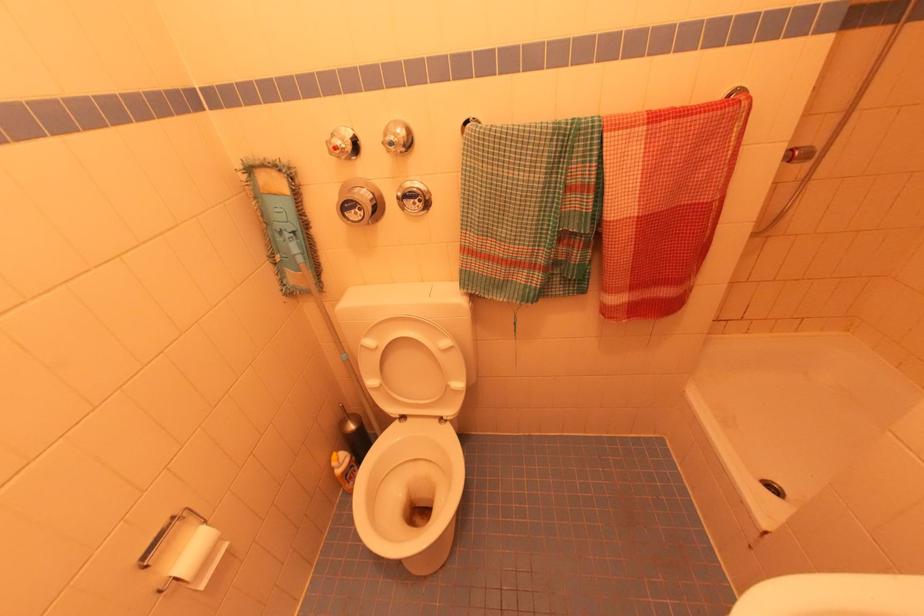
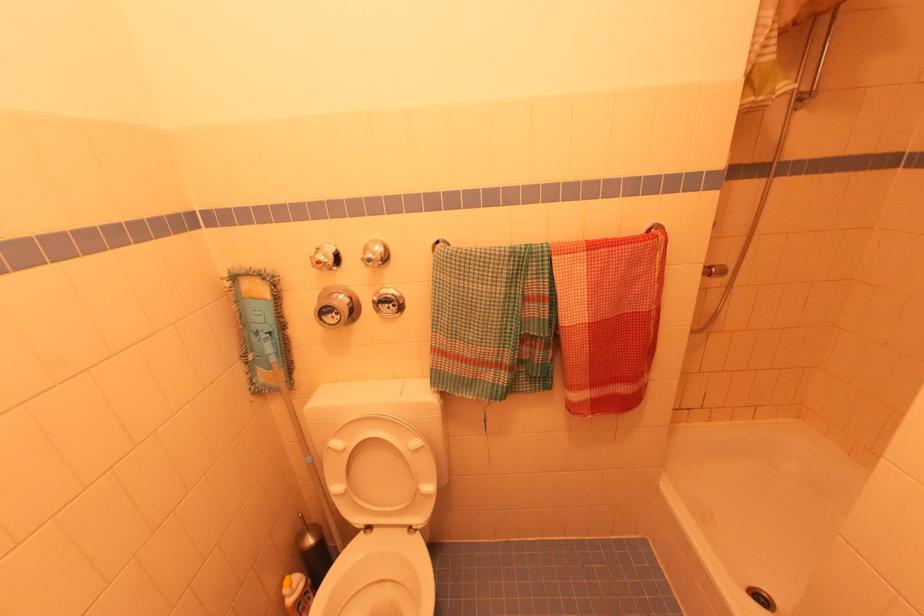
Locate, in the second image, the point that corresponds to [397,124] in the first image.

(377, 243)